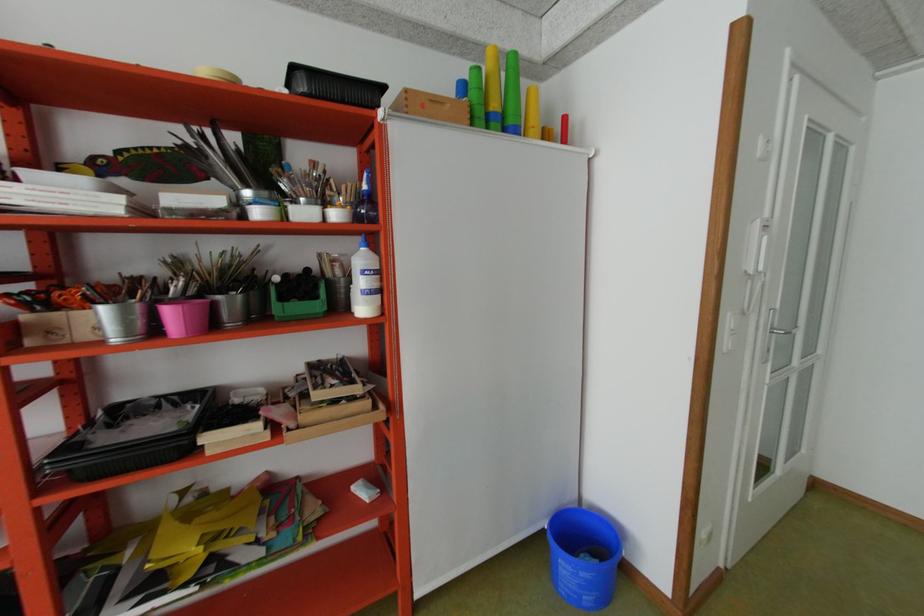
Identify the location of beaded pull chain. The height and width of the screenshot is (616, 924). (759, 249).